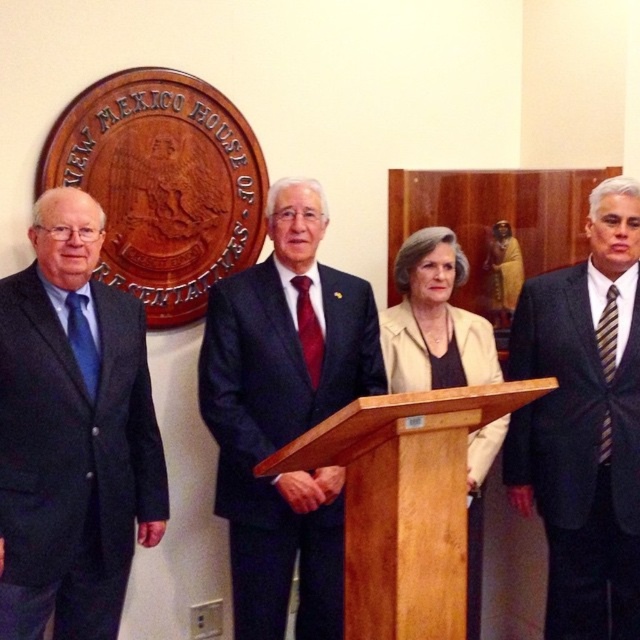
Question: Is dark blue suit at left further to the viewer compared to dark gray suit at right?

Choices:
 (A) yes
 (B) no

Answer: (B)

Question: Which point is farther from the camera taking this photo?

Choices:
 (A) (579, 314)
 (B) (317, 577)
 (C) (403, 454)

Answer: (B)

Question: Can you confirm if wooden podium at center is bigger than beige fabric jacket at center?

Choices:
 (A) yes
 (B) no

Answer: (A)

Question: Is dark blue suit at left thinner than beige fabric jacket at center?

Choices:
 (A) no
 (B) yes

Answer: (B)

Question: Considering the real-world distances, which object is closest to the beige fabric jacket at center?

Choices:
 (A) wooden podium at center
 (B) dark blue suit at left
 (C) dark blue suit at center

Answer: (C)

Question: Which point is closer to the camera taking this photo?

Choices:
 (A) (632, 369)
 (B) (492, 355)
 (C) (417, 432)

Answer: (C)